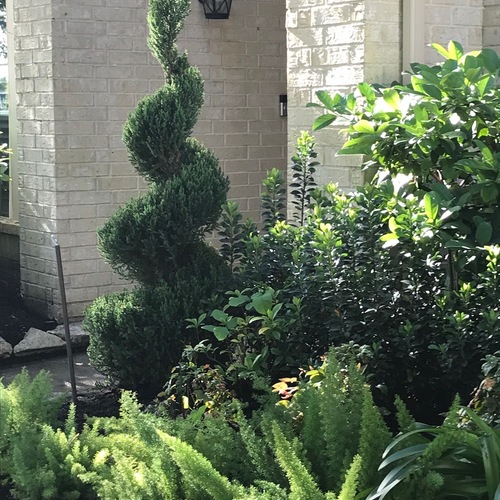
Find the location of `lamp`. lamp is located at coordinates (215, 9).